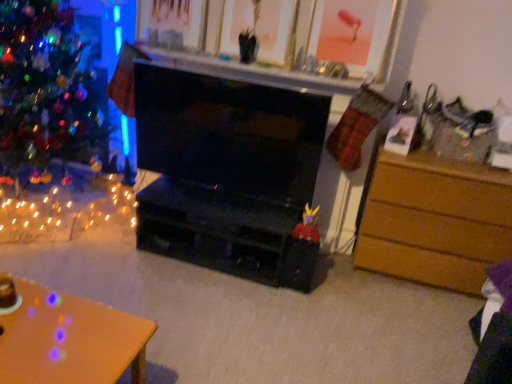
Question: From the image's perspective, is orange wood desk at lower left positioned above or below black glossy fireplace at center?

Choices:
 (A) below
 (B) above

Answer: (A)

Question: Is orange wood desk at lower left wider or thinner than black glossy fireplace at center?

Choices:
 (A) wide
 (B) thin

Answer: (A)

Question: Estimate the real-world distances between objects in this image. Which object is closer to the orange wood desk at lower left?

Choices:
 (A) brown wooden chest of drawers at right
 (B) black glossy fireplace at center
 (C) shiny multicolored ornaments at left

Answer: (B)

Question: Which is nearer to the brown wooden chest of drawers at right?

Choices:
 (A) black glossy fireplace at center
 (B) orange wood desk at lower left
 (C) shiny multicolored ornaments at left

Answer: (A)